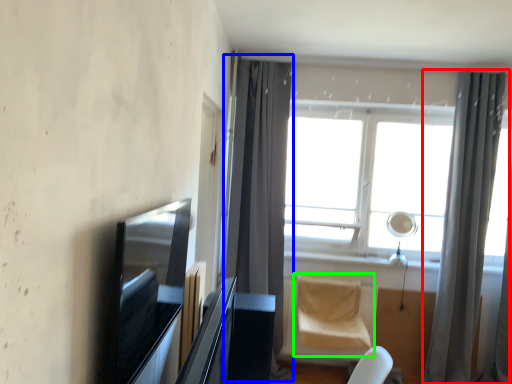
Question: Estimate the real-world distances between objects in this image. Which object is closer to curtain (highlighted by a red box), curtain (highlighted by a blue box) or swivel chair (highlighted by a green box)?

Choices:
 (A) curtain
 (B) swivel chair

Answer: (B)